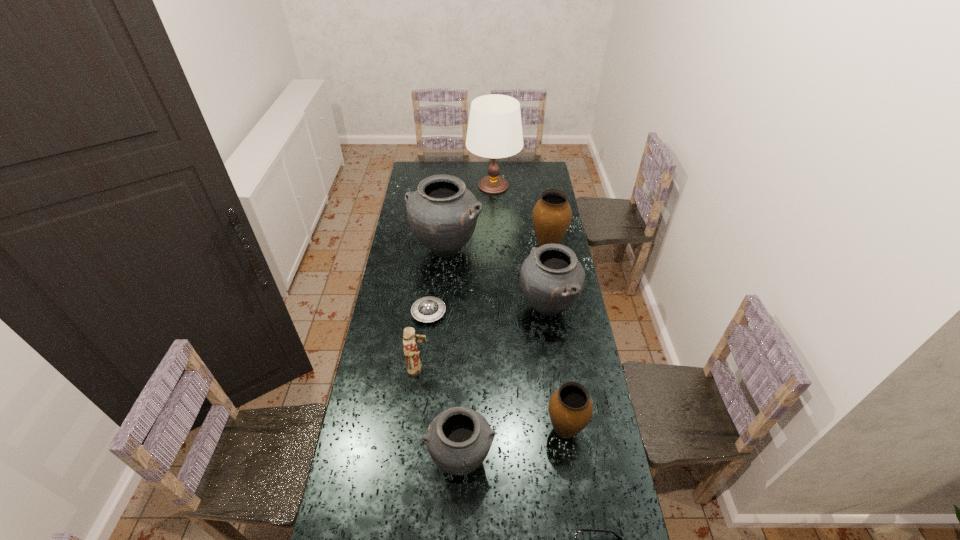
Locate an element on the screen. Image resolution: width=960 pixels, height=540 pixels. object present at the far edge is located at coordinates (494, 131).

You are a GUI agent. You are given a task and a screenshot of the screen. Output one action in this format:
    pyautogui.click(x=<x>, y=<y>)
    Task: Click on the urn located at the left edge
    This screenshot has width=960, height=540.
    Given the screenshot: What is the action you would take?
    pyautogui.click(x=442, y=213)

At what (x,y) coordinates should I click in order to perform the action: click on figurine located in the left edge section of the desktop. Please return your answer as a coordinate pair (x, y). The width and height of the screenshot is (960, 540). Looking at the image, I should click on (414, 365).

You are a GUI agent. You are given a task and a screenshot of the screen. Output one action in this format:
    pyautogui.click(x=<x>, y=<y>)
    Task: Click on the saucer present at the left edge
    This screenshot has width=960, height=540.
    Given the screenshot: What is the action you would take?
    427,309

Locate an element on the screen. blank space at the far edge of the desktop is located at coordinates pos(452,174).

This screenshot has width=960, height=540. What are the coordinates of `vacant space at the left edge of the desktop` in the screenshot? It's located at (392, 388).

In the image, there is a desktop. Where is `free space at the right edge`? Image resolution: width=960 pixels, height=540 pixels. free space at the right edge is located at coordinates (540, 194).

Locate an element on the screen. free space at the far right corner of the desktop is located at coordinates (546, 166).

The image size is (960, 540). What are the coordinates of `free point between the smaller brown urn and the tallest object` in the screenshot? It's located at (529, 308).

I want to click on unoccupied area between the farther brown urn and the farthest object, so click(520, 216).